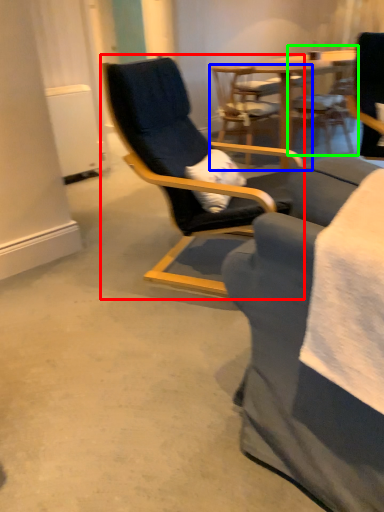
Question: Based on their relative distances, which object is nearer to chair (highlighted by a red box)? Choose from chair (highlighted by a blue box) and chair (highlighted by a green box).

Choices:
 (A) chair
 (B) chair

Answer: (A)